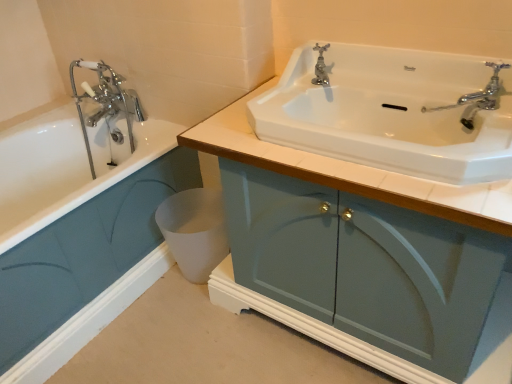
Find the location of a particular element. The image size is (512, 384). vacant position to the left of white matte toilet bowl at lower center is located at coordinates (156, 288).